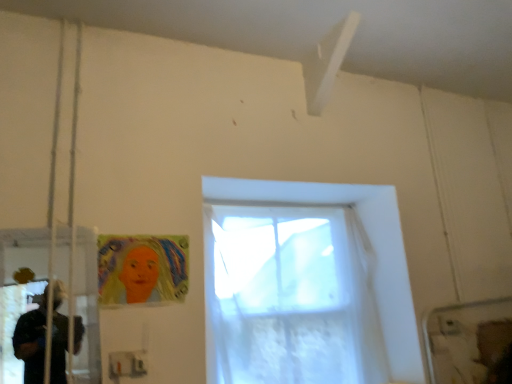
Question: In terms of height, does pastel crayon drawing of a woman at lower left look taller or shorter compared to translucent white curtain at center?

Choices:
 (A) short
 (B) tall

Answer: (A)

Question: Is pastel crayon drawing of a woman at lower left inside the boundaries of translucent white curtain at center, or outside?

Choices:
 (A) inside
 (B) outside

Answer: (B)

Question: Which of these objects is positioned farthest from the pastel crayon drawing of a woman at lower left?

Choices:
 (A) transparent plastic screen door at left
 (B) translucent white curtain at center

Answer: (B)

Question: Considering the real-world distances, which object is closest to the transparent plastic screen door at left?

Choices:
 (A) pastel crayon drawing of a woman at lower left
 (B) translucent white curtain at center

Answer: (A)